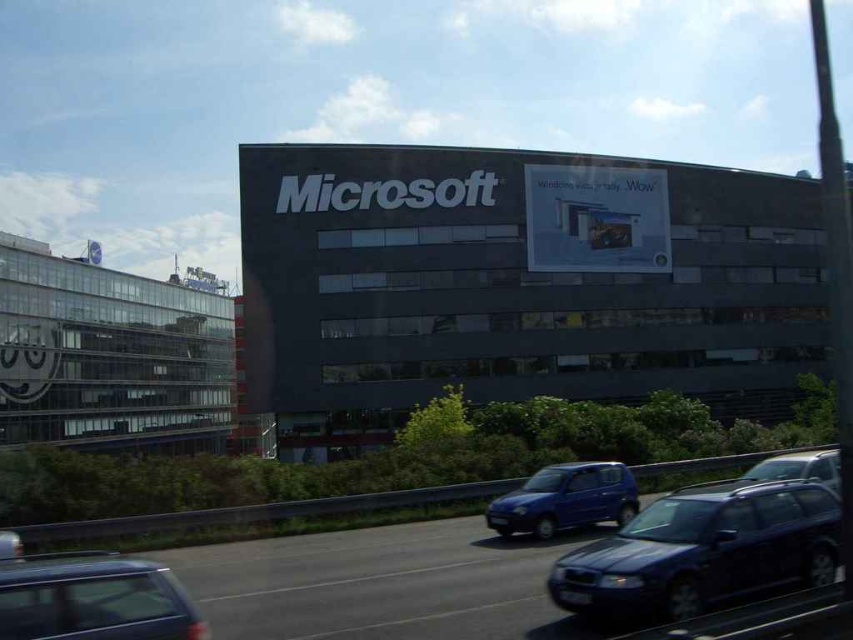
Does matte black car at lower left have a lesser width compared to metallic silver car at center?

Yes.

Who is more forward, [45,580] or [793,452]?

Point [45,580] is more forward.

The image size is (853, 640). I want to click on matte black car at lower left, so [x=93, y=600].

Can you confirm if metallic blue station wagon at center is smaller than matte black car at lower left?

No.

Does metallic blue station wagon at center have a greater width compared to matte black car at lower left?

Correct, the width of metallic blue station wagon at center exceeds that of matte black car at lower left.

Is point (805, 577) positioned after point (6, 568)?

Yes, it is behind point (6, 568).

What are the coordinates of `metallic blue station wagon at center` in the screenshot? It's located at (703, 552).

In the scene shown: Is matte blue hatchback at center thinner than metallic silver car at center?

Indeed, matte blue hatchback at center has a lesser width compared to metallic silver car at center.

You are a GUI agent. You are given a task and a screenshot of the screen. Output one action in this format:
    pyautogui.click(x=<x>, y=<y>)
    Task: Click on the matte blue hatchback at center
    This screenshot has width=853, height=640.
    Given the screenshot: What is the action you would take?
    pyautogui.click(x=566, y=499)